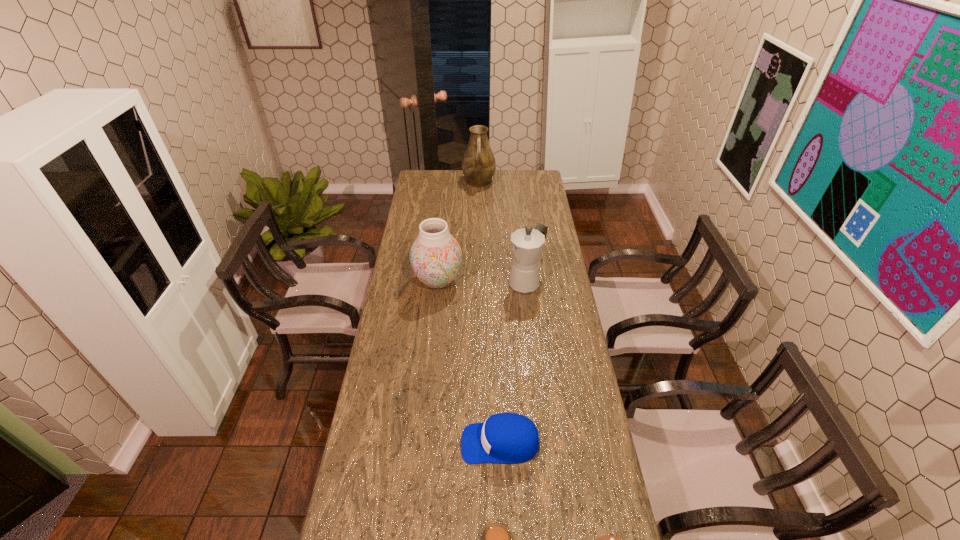
The image size is (960, 540). Find the location of `object at the far edge`. object at the far edge is located at coordinates (478, 164).

Where is `object situated at the left edge`? This screenshot has height=540, width=960. object situated at the left edge is located at coordinates (435, 256).

Image resolution: width=960 pixels, height=540 pixels. I want to click on object located in the right edge section of the desktop, so click(x=527, y=244).

The image size is (960, 540). In the image, there is a desktop. Identify the location of vacant space at the far edge. [x=454, y=172].

Identify the location of vacant area at the left edge. The image size is (960, 540). (441, 194).

Find the location of `vacant space at the right edge`. vacant space at the right edge is located at coordinates (571, 301).

What are the coordinates of `blank region between the farthest object and the coffeepot` in the screenshot? It's located at (502, 232).

Locate an element on the screen. vacant point located between the farthest object and the vase is located at coordinates (459, 232).

Identify the location of free space that is in between the farthest object and the baseball cap. (490, 313).

The height and width of the screenshot is (540, 960). Identify the location of free space that is in between the vase and the coffeepot. (482, 281).